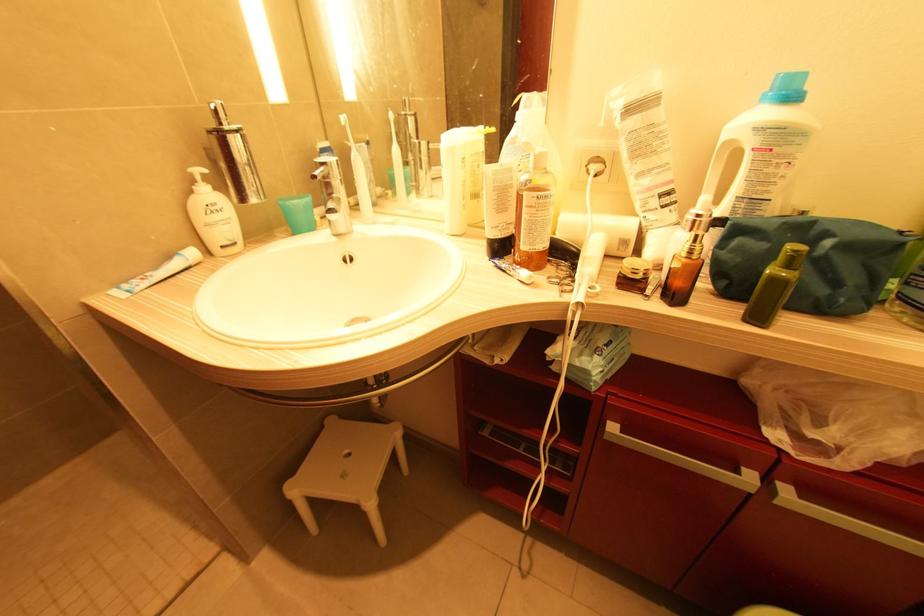
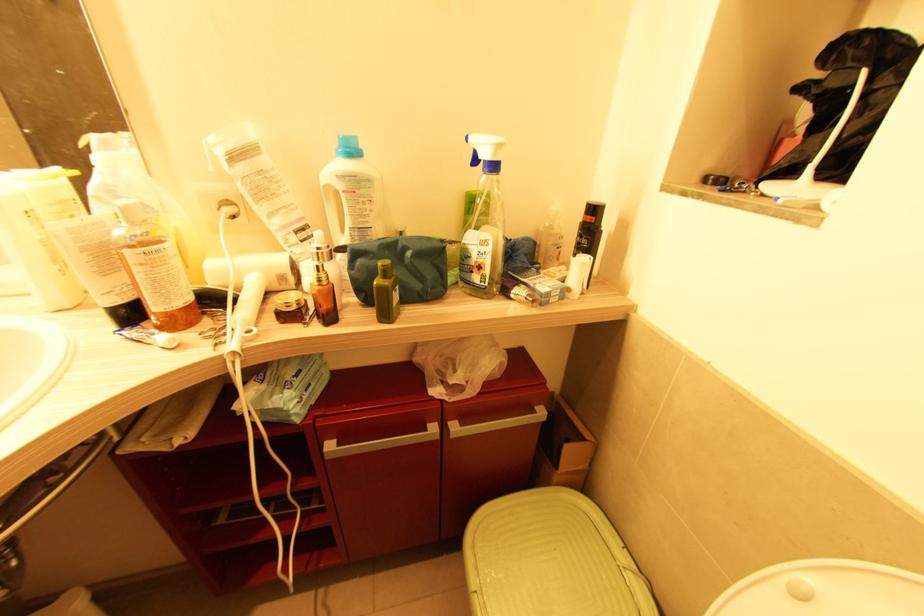
The point at (727,145) is marked in the first image. Where is the corresponding point in the second image?

(329, 188)